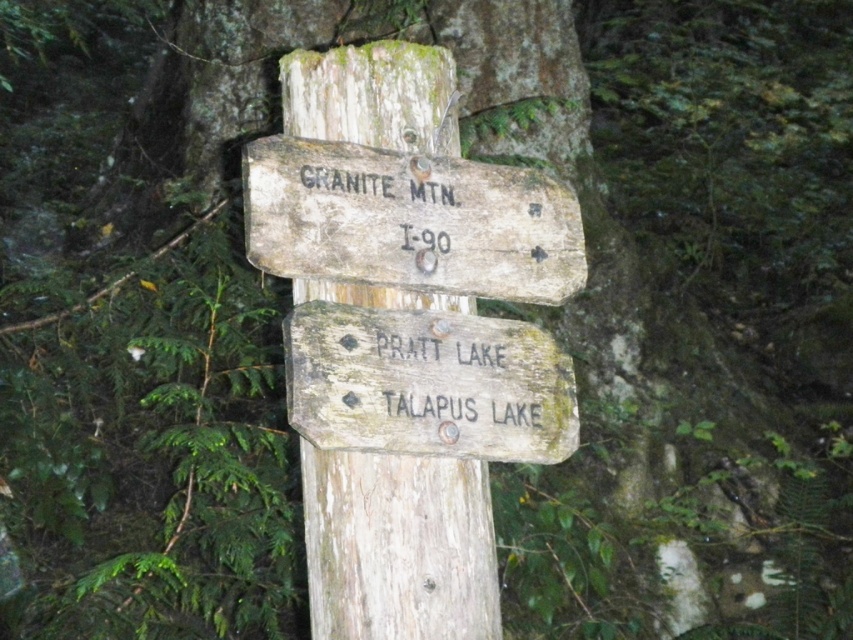
You are a hiker trying to read the signs on the weathered wood signpost at center and the weathered wood signpost at upper center. Which signpost do you need to look up higher to read?

The weathered wood signpost at center has a greater height compared to the weathered wood signpost at upper center, so you need to look up higher to read the weathered wood signpost at center.

You are standing in a forest and see the weathered wood signpost at center. You need to read the directions clearly. Can you step closer to the signpost without moving past it? Explain why or why not based on the distance between you and the signpost.

The distance between you and the weathered wood signpost at center is 7.75 feet. Since you can move closer as long as you don not pass the signpost, you can step forward to reduce the distance while remaining in front of it.

You are a hiker trying to read the directions on the weathered wood signpost at upper center and the weathered wood sign at center. Which one do you need to look at more closely because it is smaller?

The weathered wood sign at center is smaller than the weathered wood signpost at upper center, so you need to look at the weathered wood sign at center more closely because it is smaller.